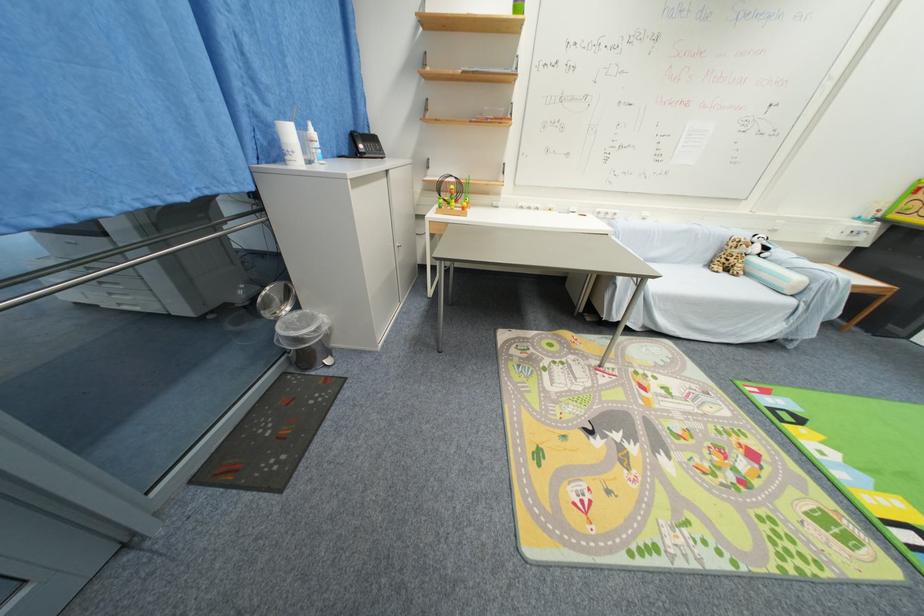
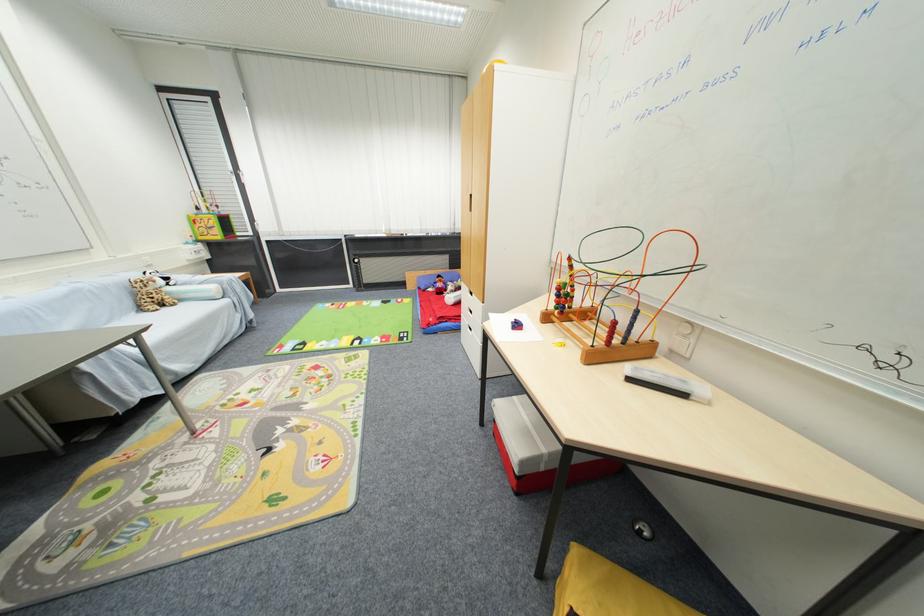
In the second image, find the point that corresponds to (714,265) in the first image.

(146, 310)